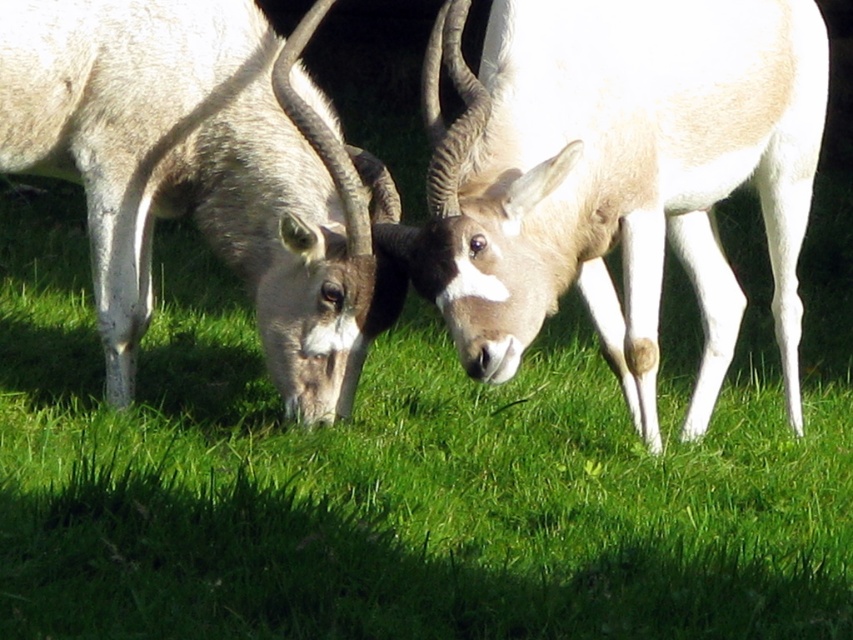
You are an animal keeper in a zoo and need to place a feeding station for the antelopes. The feeding station must be placed exactly where the green grass at center is located. What are the coordinates where you should place the feeding station?

The coordinates for the green grass at center are at point [412,468], so you should place the feeding station there.

You are standing in the field and see the green grass at center and the white woolen antelope at center. Which object is located to the right of the other?

The green grass at center is to the right of the white woolen antelope at center according to the description.